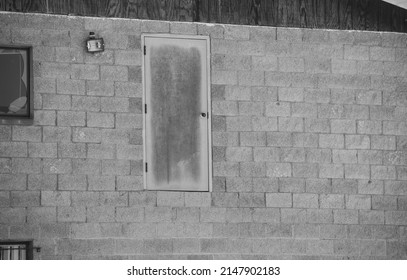
This screenshot has height=280, width=407. Find the location of `window`. window is located at coordinates (15, 73).